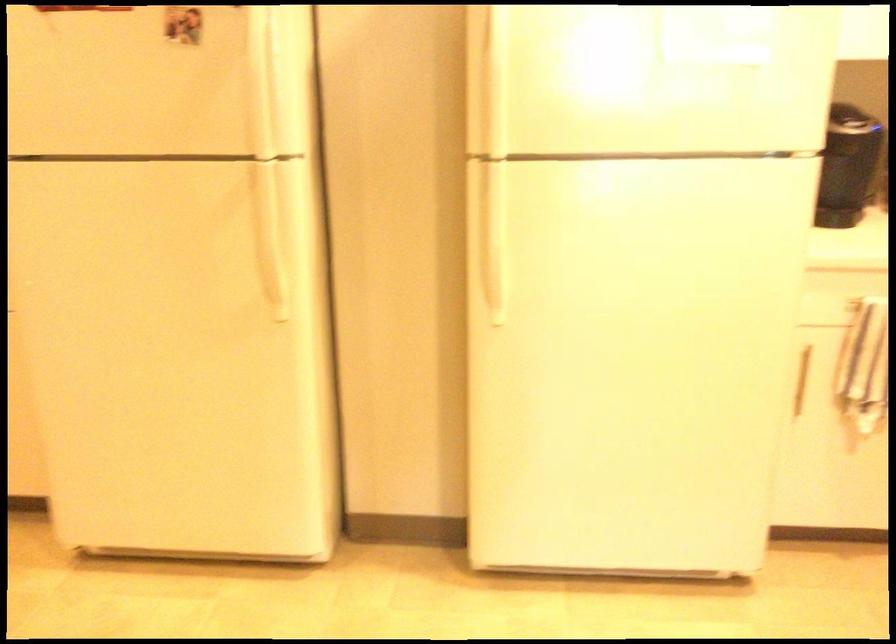
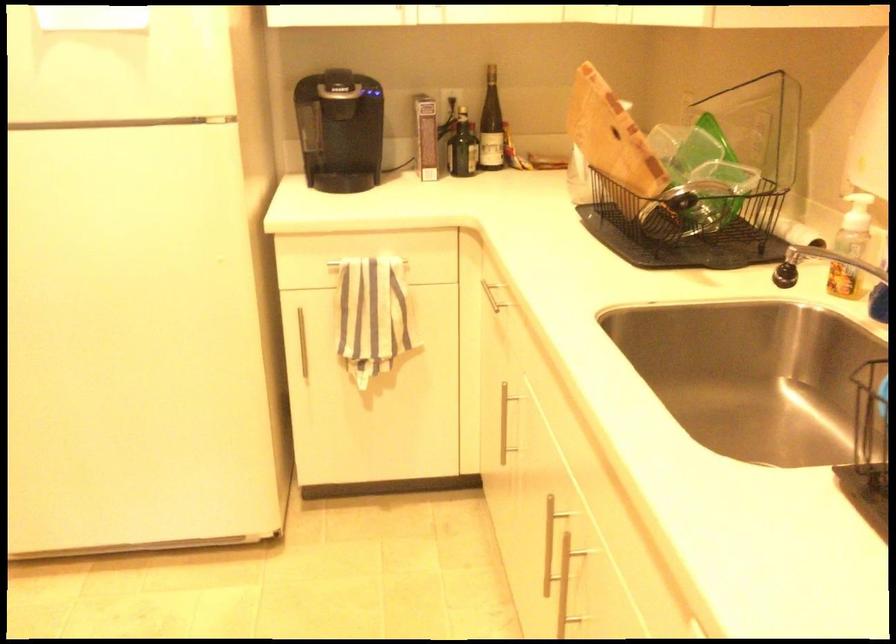
Question: The first image is from the beginning of the video and the second image is from the end. How did the camera likely rotate when shooting the video?

Choices:
 (A) Left
 (B) Right
 (C) Up
 (D) Down

Answer: (B)